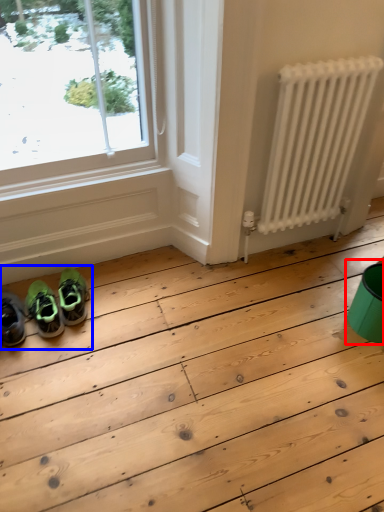
Question: Which point is closer to the camera, teal (highlighted by a red box) or couple (highlighted by a blue box)?

Choices:
 (A) teal
 (B) couple

Answer: (A)